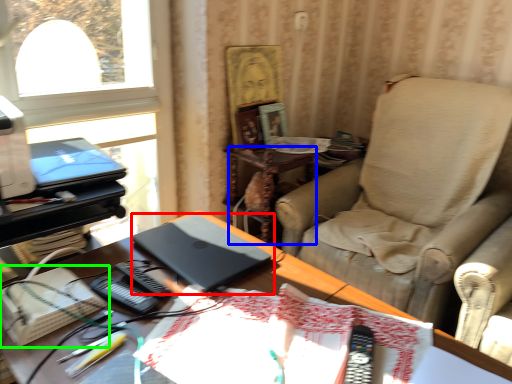
Question: Which is farther away from laptop (highlighted by a red box)? side table (highlighted by a blue box) or paperback book (highlighted by a green box)?

Choices:
 (A) side table
 (B) paperback book

Answer: (A)